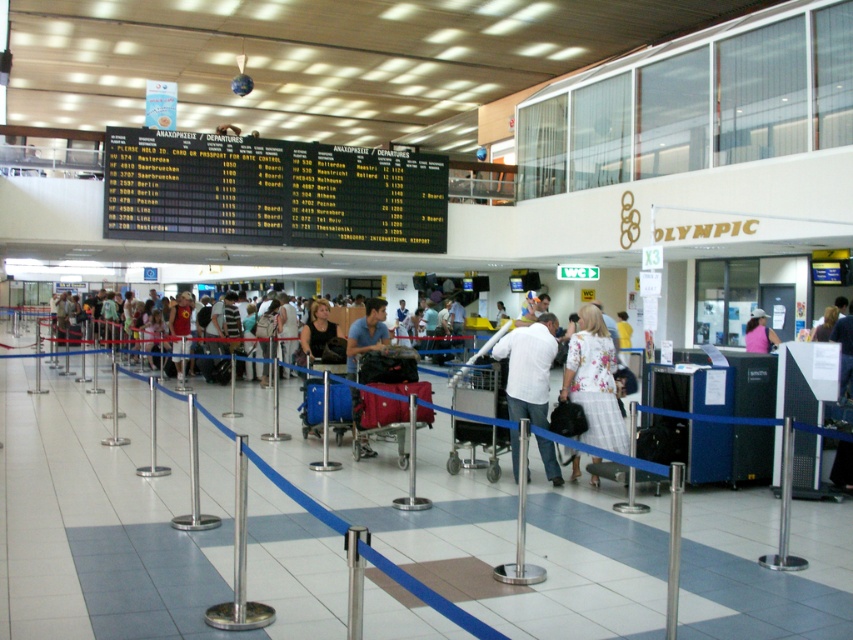
Which is more to the right, floral-patterned dress at center or blue fabric shirt at center?

From the viewer's perspective, floral-patterned dress at center appears more on the right side.

Consider the image. Who is taller, floral-patterned dress at center or blue fabric shirt at center?

Standing taller between the two is floral-patterned dress at center.

Find the location of `floral-patterned dress at center`. floral-patterned dress at center is located at coordinates (595, 381).

Can you confirm if blue fabric shirt at center is positioned to the left of metallic pole at center?

Indeed, blue fabric shirt at center is positioned on the left side of metallic pole at center.

Between blue fabric shirt at center and metallic pole at center, which one has more height?

With more height is blue fabric shirt at center.

In order to click on blue fabric shirt at center in this screenshot , I will do `click(366, 333)`.

You are a GUI agent. You are given a task and a screenshot of the screen. Output one action in this format:
    pyautogui.click(x=<x>, y=<y>)
    Task: Click on the blue fabric shirt at center
    The height and width of the screenshot is (640, 853).
    Given the screenshot: What is the action you would take?
    pos(366,333)

Measure the distance from white matte shirt at center to blue fabric shirt at center.

They are 5.97 feet apart.

Locate an element on the screen. Image resolution: width=853 pixels, height=640 pixels. white matte shirt at center is located at coordinates (527, 368).

At what (x,y) coordinates should I click in order to perform the action: click on white matte shirt at center. Please return your answer as a coordinate pair (x, y). Looking at the image, I should click on (527, 368).